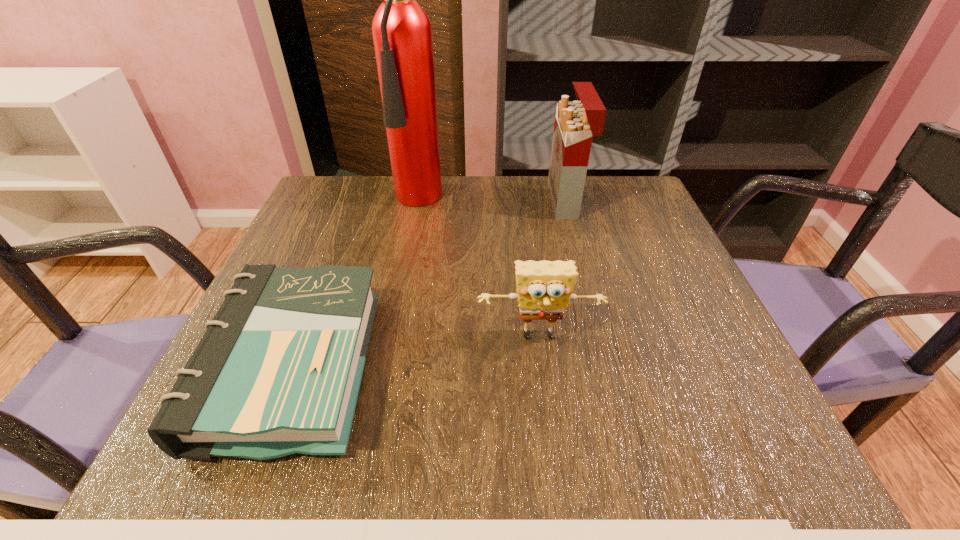
This screenshot has width=960, height=540. I want to click on the tallest object, so click(x=402, y=34).

Where is `cigarette case`? The image size is (960, 540). cigarette case is located at coordinates (576, 122).

Where is `sponge`? The height and width of the screenshot is (540, 960). sponge is located at coordinates (544, 288).

Where is `the shortest object`? This screenshot has height=540, width=960. the shortest object is located at coordinates (278, 370).

Identify the location of vacant space located 0.090m at the nozzle of the fire extinguisher. (427, 241).

The image size is (960, 540). Find the location of `free region located with the lid open on the third shortest object`. free region located with the lid open on the third shortest object is located at coordinates (404, 201).

Find the location of a particular element. free region located with the lid open on the third shortest object is located at coordinates (503, 201).

The width and height of the screenshot is (960, 540). Find the location of `vacant space located 0.070m with the lid open on the third shortest object`. vacant space located 0.070m with the lid open on the third shortest object is located at coordinates (523, 201).

Where is `vacant space located 0.070m on the face of the sponge`? vacant space located 0.070m on the face of the sponge is located at coordinates (545, 388).

Where is `free space located 0.180m on the back of the shortest object`? Image resolution: width=960 pixels, height=540 pixels. free space located 0.180m on the back of the shortest object is located at coordinates (341, 242).